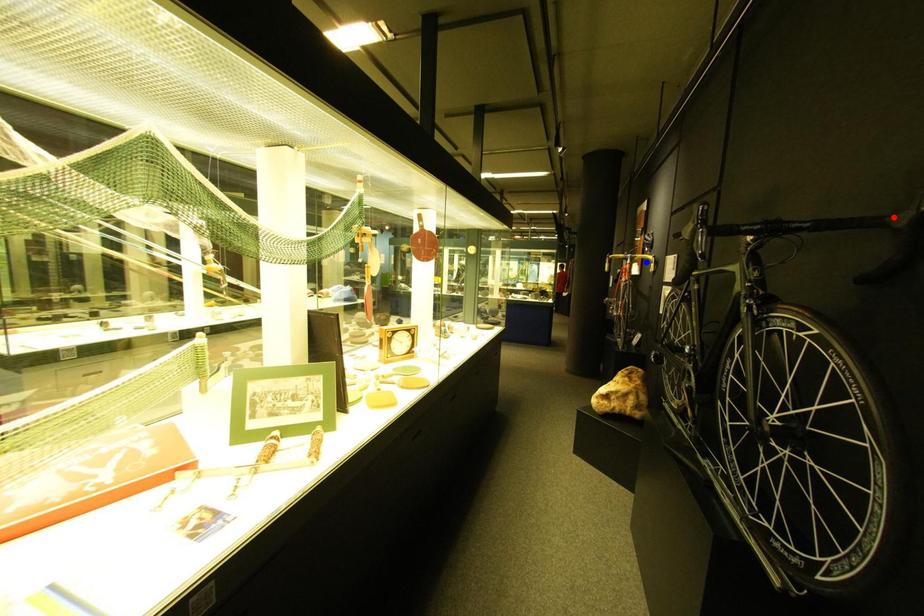
Question: Two points are marked on the image. Which point is closer to the camera?

Choices:
 (A) Blue point is closer.
 (B) Red point is closer.

Answer: (B)